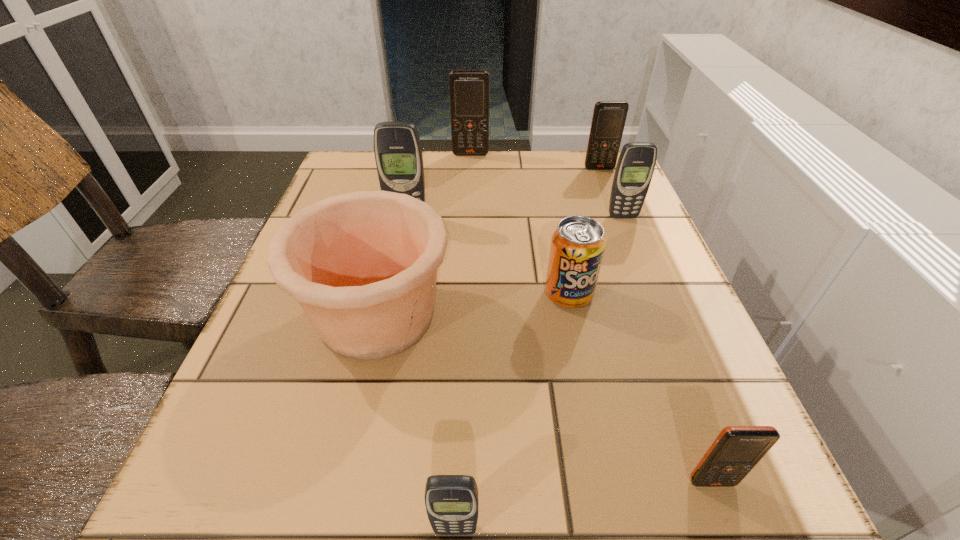
I want to click on empty location between the second farthest cellular telephone and the nearest orange cellular telephone, so click(x=656, y=325).

The image size is (960, 540). Identify the location of vacant space in between the leftmost gray cellular telephone and the nearest object. (431, 373).

At what (x,y) coordinates should I click in order to perform the action: click on free point between the nearest cellular telephone and the fifth nearest cellular telephone. Please return your answer as a coordinate pair (x, y). Looking at the image, I should click on (527, 349).

Identify the location of free space between the soda can and the pottery. (472, 305).

Locate an element on the screen. Image resolution: width=960 pixels, height=540 pixels. vacant space that's between the second biggest orange cellular telephone and the leftmost cellular telephone is located at coordinates (503, 193).

Where is `blank region between the nearest gray cellular telephone and the second nearest orange cellular telephone`? The width and height of the screenshot is (960, 540). blank region between the nearest gray cellular telephone and the second nearest orange cellular telephone is located at coordinates 527,349.

Locate an element on the screen. This screenshot has width=960, height=540. vacant space that's between the leftmost orange cellular telephone and the nearest object is located at coordinates (463, 341).

Select which object appears as the fourth closest to the soda can. Please provide its 2D coordinates. Your answer should be formatted as a tuple, i.e. [(x, y)], where the tuple contains the x and y coordinates of a point satisfying the conditions above.

[(398, 154)]

At what (x,y) coordinates should I click in order to perform the action: click on the closest object to the leftmost orange cellular telephone. Please return your answer as a coordinate pair (x, y). Looking at the image, I should click on (609, 117).

Select which cellular telephone appears as the fifth closest to the biggest gray cellular telephone. Please provide its 2D coordinates. Your answer should be formatted as a tuple, i.e. [(x, y)], where the tuple contains the x and y coordinates of a point satisfying the conditions above.

[(734, 453)]